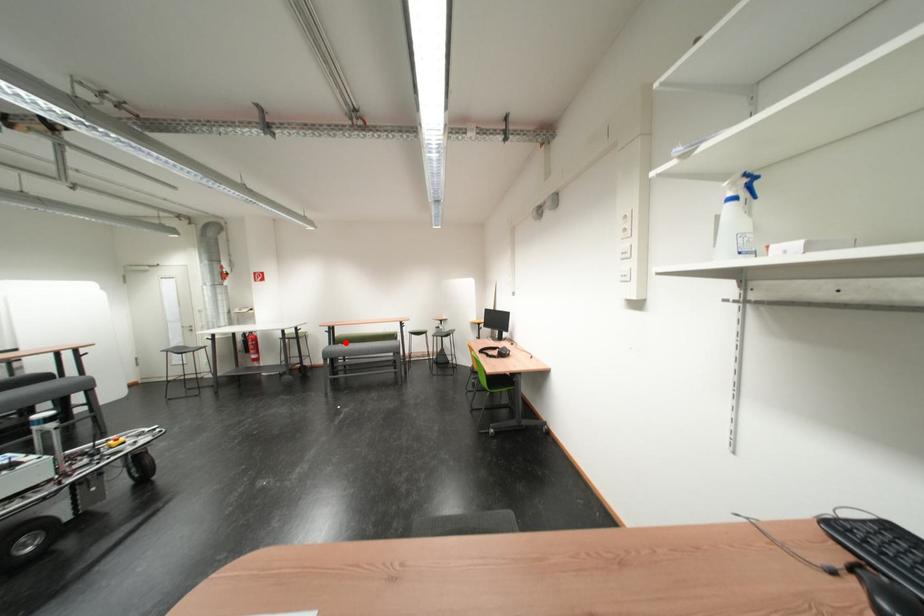
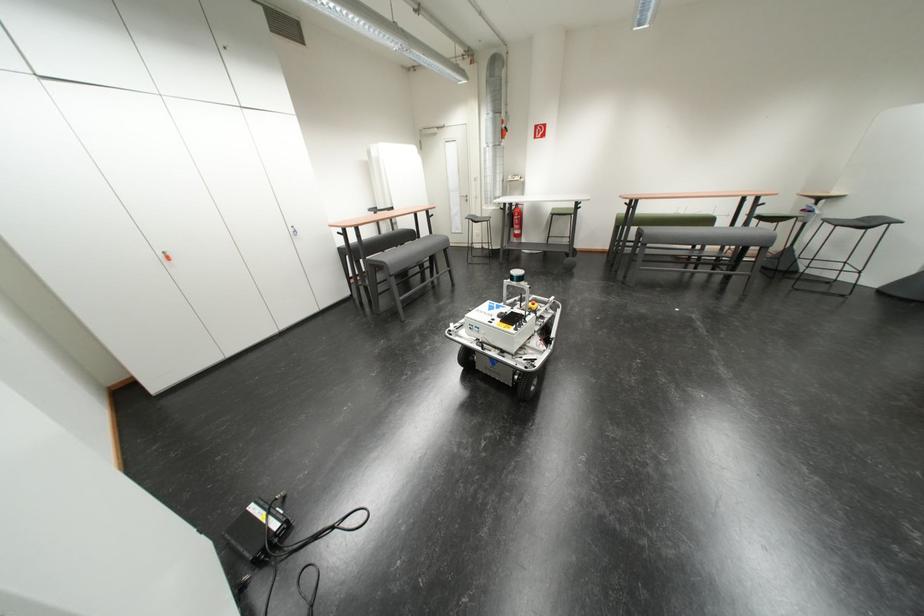
Where in the second image is the point corresponding to the highlighted location from the first image?

(638, 223)